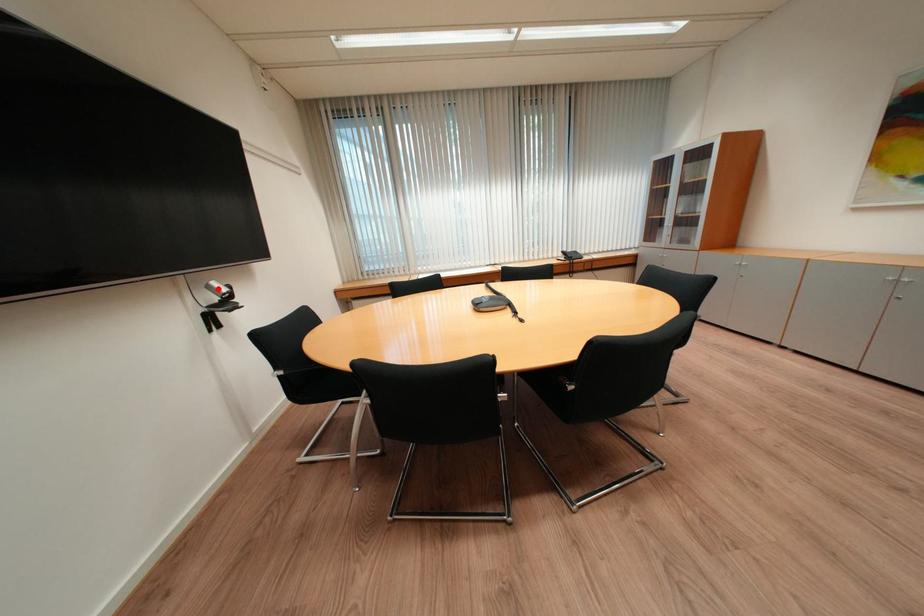
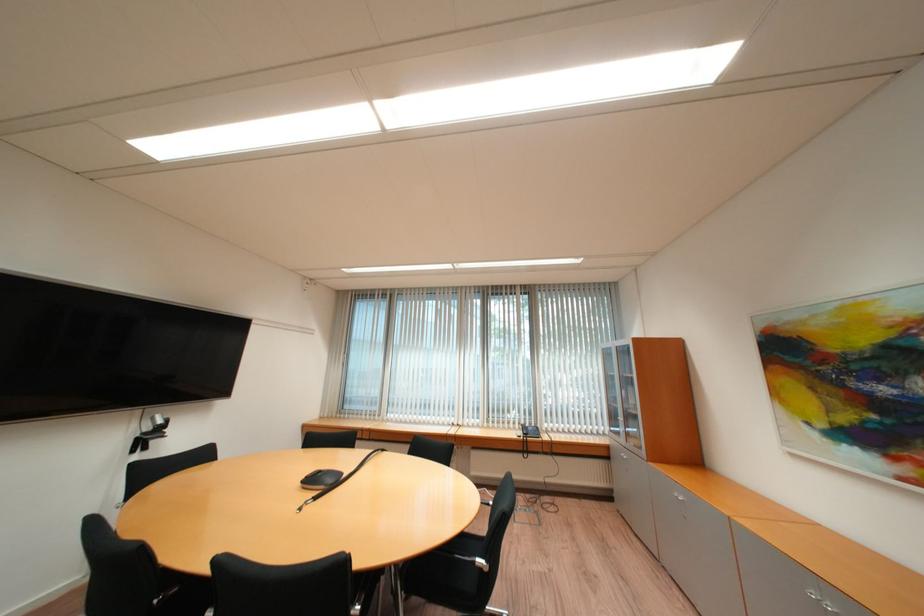
The point at the highlighted location is marked in the first image. Where is the corresponding point in the second image?

(162, 419)